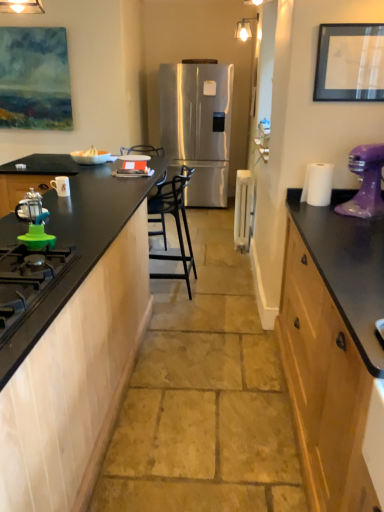
Measure the distance between point (214, 148) and camera.

6.10 meters.

What is the approximate height of white ceramic mug at left, placed as the 3th appliance when sorted from back to front?

13.62 centimeters.

Where is `black metal chair at center`? The height and width of the screenshot is (512, 384). black metal chair at center is located at coordinates (175, 221).

Which is less distant, (59, 176) or (247, 233)?

Point (59, 176) appears to be closer to the viewer than point (247, 233).

Considering the relative positions of white ceramic mug at left, the third appliance when ordered from front to back, and white plastic radiator at center, the 1th appliance viewed from the right, in the image provided, is white ceramic mug at left, the third appliance when ordered from front to back, to the left of white plastic radiator at center, the 1th appliance viewed from the right, from the viewer's perspective?

Indeed, white ceramic mug at left, the third appliance when ordered from front to back, is positioned on the left side of white plastic radiator at center, the 1th appliance viewed from the right.

Would you say white ceramic mug at left, placed as the 3th appliance when sorted from back to front, is a long distance from white plastic radiator at center, arranged as the first appliance when viewed from the back?

white ceramic mug at left, placed as the 3th appliance when sorted from back to front, is far away from white plastic radiator at center, arranged as the first appliance when viewed from the back.

Consider the image. Could you tell me if white ceramic mug at left, positioned as the 2th appliance in left-to-right order, is turned towards white plastic radiator at center, arranged as the first appliance when viewed from the back?

No, white ceramic mug at left, positioned as the 2th appliance in left-to-right order, does not turn towards white plastic radiator at center, arranged as the first appliance when viewed from the back.

Consider the image. Does purple glossy stand mixer at right contain green rubber gas stove at lower left?

No.

From a real-world perspective, who is located higher, purple glossy stand mixer at right or green rubber gas stove at lower left?

In real-world perspective, purple glossy stand mixer at right is above.

Does point (365, 180) come behind point (61, 268)?

Yes, it is.

Is purple glossy stand mixer at right at the right side of green rubber gas stove at lower left?

Correct, you'll find purple glossy stand mixer at right to the right of green rubber gas stove at lower left.

Considering the sizes of objects green rubber gas stove at lower left and white matte bowl at center, positioned as the fifth appliance in right-to-left order, in the image provided, who is smaller, green rubber gas stove at lower left or white matte bowl at center, positioned as the fifth appliance in right-to-left order,?

Smaller between the two is white matte bowl at center, positioned as the fifth appliance in right-to-left order.

Considering the sizes of objects green rubber gas stove at lower left and white matte bowl at center, the second appliance viewed from the back, in the image provided, who is shorter, green rubber gas stove at lower left or white matte bowl at center, the second appliance viewed from the back,?

green rubber gas stove at lower left.

Would you consider green rubber gas stove at lower left to be distant from white matte bowl at center, the fourth appliance in the front-to-back sequence?

Yes, green rubber gas stove at lower left and white matte bowl at center, the fourth appliance in the front-to-back sequence, are located far from each other.

From the image's perspective, is green rubber gas stove at lower left above or below white matte bowl at center, positioned as the fifth appliance in right-to-left order?

Clearly, from the image's perspective, green rubber gas stove at lower left is below white matte bowl at center, positioned as the fifth appliance in right-to-left order.

From a real-world perspective, is green rubber gas stove at lower left physically located above or below stainless steel refrigerator at center?

green rubber gas stove at lower left is above stainless steel refrigerator at center.

Is green rubber gas stove at lower left shorter than stainless steel refrigerator at center?

Yes.

Would you say green rubber gas stove at lower left is inside or outside stainless steel refrigerator at center?

green rubber gas stove at lower left is not inside stainless steel refrigerator at center, it's outside.

Which of these two, green rubber gas stove at lower left or stainless steel refrigerator at center, is smaller?

Smaller between the two is green rubber gas stove at lower left.

From a real-world perspective, who is located higher, white matte paper towel at right or white plastic radiator at center, the 5th appliance from the front?

From a 3D spatial view, white matte paper towel at right is above.

In the scene shown: Which of these two, white matte paper towel at right or white plastic radiator at center, the 1th appliance viewed from the right, is bigger?

white plastic radiator at center, the 1th appliance viewed from the right.

Is white matte paper towel at right taller than white plastic radiator at center, arranged as the first appliance when viewed from the back?

No.

How many degrees apart are the facing directions of green plastic lid at lower left, which appears as the 5th appliance when viewed from the back, and green rubber gas stove at lower left?

green plastic lid at lower left, which appears as the 5th appliance when viewed from the back, and green rubber gas stove at lower left are facing 0.483 degrees away from each other.

From the image's perspective, would you say green plastic lid at lower left, which appears as the 5th appliance when viewed from the back, is positioned over green rubber gas stove at lower left?

Yes.

Between point (42, 237) and point (33, 288), which one is positioned behind?

The point (42, 237) is farther.

Consider the image. Considering the relative sizes of matte black coffee press at left, which is counted as the second appliance, starting from the front, and black metal chair at center in the image provided, is matte black coffee press at left, which is counted as the second appliance, starting from the front, wider than black metal chair at center?

No, matte black coffee press at left, which is counted as the second appliance, starting from the front, is not wider than black metal chair at center.

Are matte black coffee press at left, the third appliance viewed from the left, and black metal chair at center making contact?

No, matte black coffee press at left, the third appliance viewed from the left, is not next to black metal chair at center.

Consider the image. Can you confirm if matte black coffee press at left, which is counted as the second appliance, starting from the front, is shorter than black metal chair at center?

Yes.

Starting from the white ceramic mug at left, the third appliance when ordered from front to back, which appliance is the 3rd one to the right? Please provide its 2D coordinates.

[(243, 209)]

You are a GUI agent. You are given a task and a screenshot of the screen. Output one action in this format:
    pyautogui.click(x=<x>, y=<y>)
    Task: Click on the kitchen appliance above the green rubber gas stove at lower left (from the image's perspective)
    Image resolution: width=384 pixels, height=512 pixels.
    Given the screenshot: What is the action you would take?
    pyautogui.click(x=365, y=182)

Which object lies nearer to the anchor point matte black coffee press at left, the third appliance viewed from the left, white matte paper towel at right or black metal chair at center?

black metal chair at center.

Estimate the real-world distances between objects in this image. Which object is further from white plastic radiator at center, arranged as the first appliance when viewed from the back, green plastic lid at lower left, arranged as the first appliance when viewed from the front, or white matte paper towel at right?

The object further to white plastic radiator at center, arranged as the first appliance when viewed from the back, is green plastic lid at lower left, arranged as the first appliance when viewed from the front.

Which object lies nearer to the anchor point green plastic lid at lower left, which appears as the 5th appliance when viewed from the back, stainless steel refrigerator at center or black matte picture frame at upper right?

Based on the image, black matte picture frame at upper right appears to be nearer to green plastic lid at lower left, which appears as the 5th appliance when viewed from the back.

From the image, which object appears to be farther from matte black coffee press at left, which is the fourth appliance in back-to-front order, white matte bowl at center, the fourth appliance in the front-to-back sequence, or green plastic lid at lower left, arranged as the first appliance when viewed from the front?

white matte bowl at center, the fourth appliance in the front-to-back sequence, is positioned further to the anchor matte black coffee press at left, which is the fourth appliance in back-to-front order.

When comparing their distances from white matte bowl at center, marked as the 1th appliance in a left-to-right arrangement, does stainless steel refrigerator at center or black matte picture frame at upper right seem closer?

black matte picture frame at upper right is closer to white matte bowl at center, marked as the 1th appliance in a left-to-right arrangement.

Based on their spatial positions, is black matte picture frame at upper right or white plastic radiator at center, the 5th appliance from the front, closer to green rubber gas stove at lower left?

black matte picture frame at upper right is closer to green rubber gas stove at lower left.

From the image, which object appears to be nearer to green plastic lid at lower left, arranged as the first appliance when viewed from the front, white matte bowl at center, marked as the 1th appliance in a left-to-right arrangement, or white plastic radiator at center, arranged as the first appliance when viewed from the back?

white matte bowl at center, marked as the 1th appliance in a left-to-right arrangement, is positioned closer to the anchor green plastic lid at lower left, arranged as the first appliance when viewed from the front.

Based on their spatial positions, is stainless steel refrigerator at center or matte black coffee press at left, which is the fourth appliance in back-to-front order, closer to white matte bowl at center, the fourth appliance in the front-to-back sequence?

matte black coffee press at left, which is the fourth appliance in back-to-front order, is closer to white matte bowl at center, the fourth appliance in the front-to-back sequence.

Where is `gas stove situated between white ceramic mug at left, positioned as the 2th appliance in left-to-right order, and white matte paper towel at right from left to right`? This screenshot has height=512, width=384. gas stove situated between white ceramic mug at left, positioned as the 2th appliance in left-to-right order, and white matte paper towel at right from left to right is located at coordinates (28, 282).

Find the location of `paper towel between white ceramic mug at left, placed as the 3th appliance when sorted from back to front, and purple glossy stand mixer at right from left to right`. paper towel between white ceramic mug at left, placed as the 3th appliance when sorted from back to front, and purple glossy stand mixer at right from left to right is located at coordinates (318, 184).

The height and width of the screenshot is (512, 384). I want to click on kitchen appliance positioned between green rubber gas stove at lower left and white plastic radiator at center, arranged as the first appliance when viewed from the back, from near to far, so click(x=365, y=182).

I want to click on paper towel between white matte bowl at center, positioned as the fifth appliance in right-to-left order, and black matte picture frame at upper right, so click(x=318, y=184).